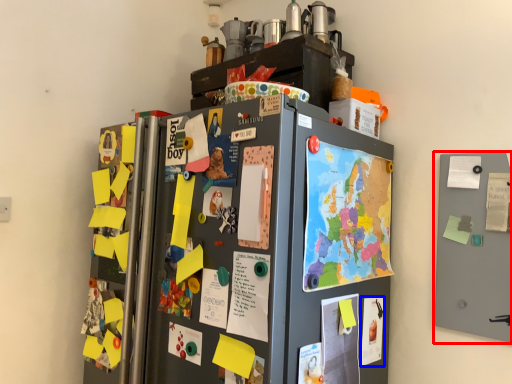
Question: Which of the following is the farthest to the observer, door (highlighted by a red box) or poster (highlighted by a blue box)?

Choices:
 (A) door
 (B) poster

Answer: (B)